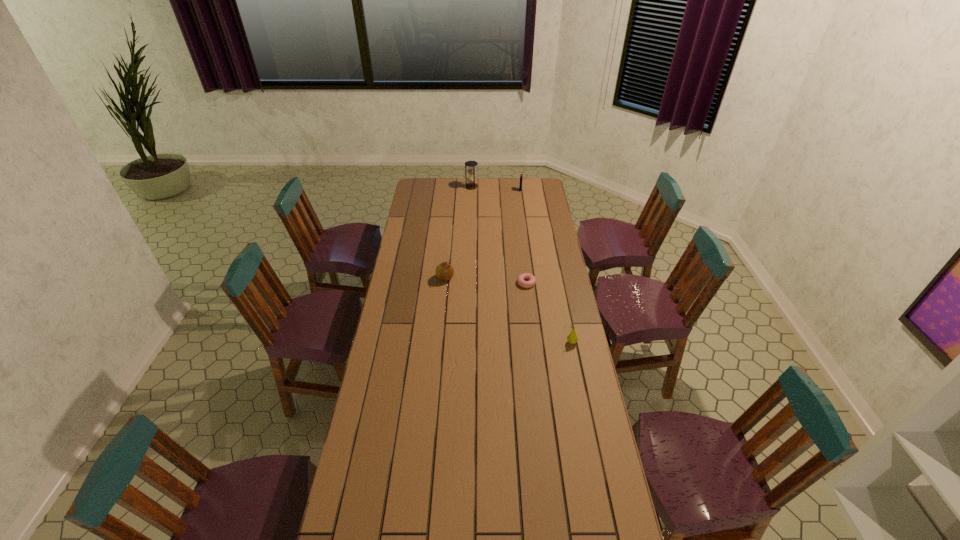
The height and width of the screenshot is (540, 960). I want to click on vacant area at the left edge of the desktop, so click(409, 300).

Where is `free space at the far left corner`? Image resolution: width=960 pixels, height=540 pixels. free space at the far left corner is located at coordinates (423, 185).

This screenshot has width=960, height=540. In order to click on vacant space in between the farther pear and the igniter in this screenshot , I will do `click(483, 234)`.

Identify the location of vacant space in between the farther pear and the shortest object. point(486,280).

Find the location of a particular element. This screenshot has width=960, height=540. free area in between the tallest object and the doughnut is located at coordinates (499, 235).

The image size is (960, 540). Find the location of `free space between the fourth tallest object and the second object from left to right`. free space between the fourth tallest object and the second object from left to right is located at coordinates (521, 265).

Find the location of `vacant area that lies between the igniter and the doughnut`. vacant area that lies between the igniter and the doughnut is located at coordinates (523, 237).

Identify the location of free spot between the leftmost object and the second object from left to right. (458, 232).

In order to click on free space that is in between the igniter and the shortest object in this screenshot , I will do `click(523, 237)`.

Select which object is the fourth closest to the shortest object. Please provide its 2D coordinates. Your answer should be formatted as a tuple, i.e. [(x, y)], where the tuple contains the x and y coordinates of a point satisfying the conditions above.

[(471, 184)]